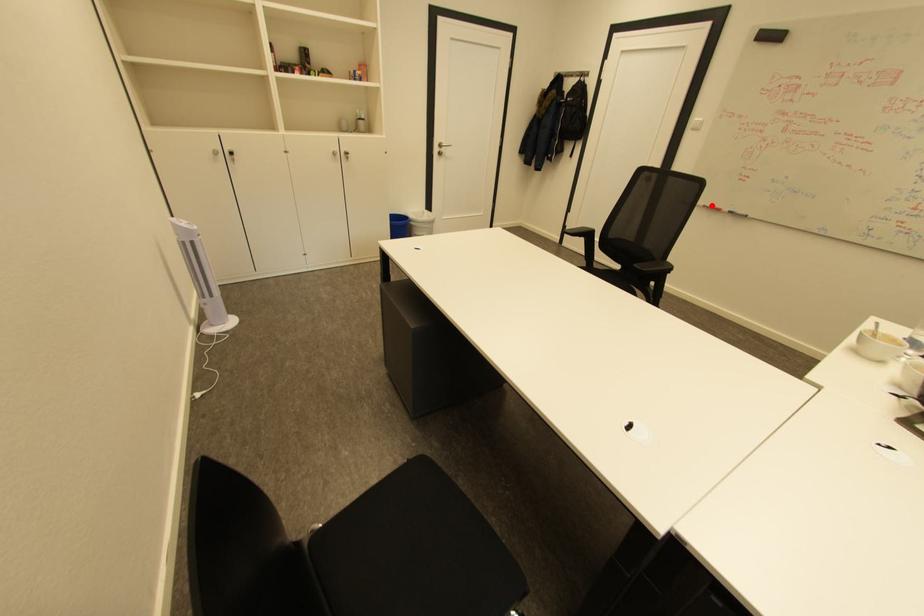
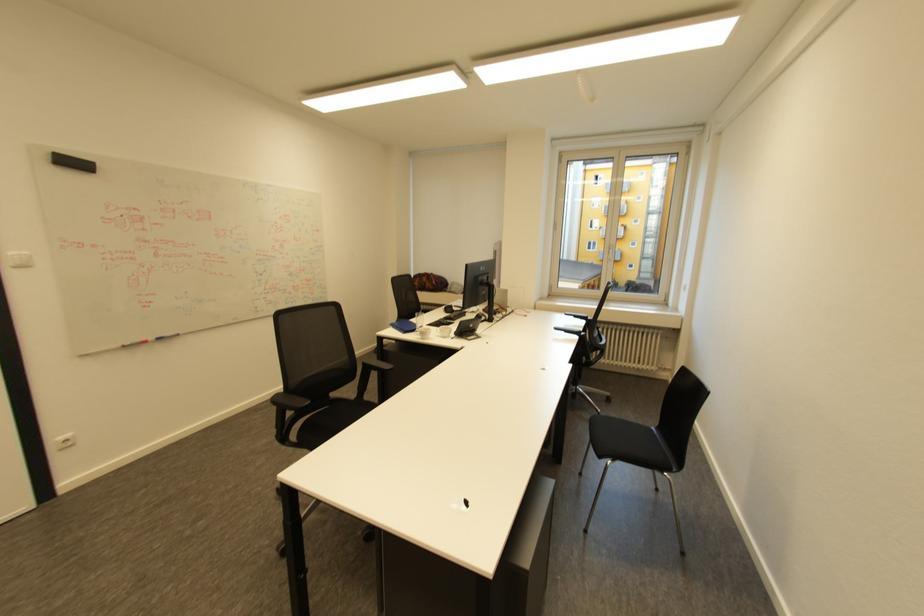
Locate, in the second image, the point that corresponds to the highlighted location in the first image.

(128, 346)